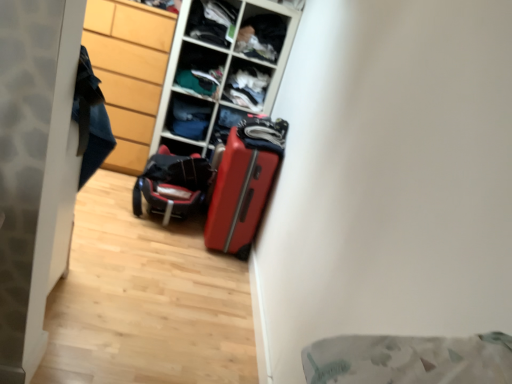
Measure the distance between matte plastic cabinet at center and camera.

The distance of matte plastic cabinet at center from camera is 10.35 feet.

The image size is (512, 384). Find the location of `dark fabric clothes at upper center, which ranks as the second shelf in top-to-bottom order`. dark fabric clothes at upper center, which ranks as the second shelf in top-to-bottom order is located at coordinates (261, 37).

The width and height of the screenshot is (512, 384). What do you see at coordinates (261, 37) in the screenshot? I see `dark fabric clothes at upper center, positioned as the 4th shelf in bottom-to-top order` at bounding box center [261, 37].

Locate an element on the screen. This screenshot has width=512, height=384. shiny red suitcase at center is located at coordinates (243, 183).

What do you see at coordinates (129, 72) in the screenshot? I see `wooden cabinet at left` at bounding box center [129, 72].

What do you see at coordinates (223, 67) in the screenshot?
I see `wooden textured shelf at center, which ranks as the fourth shelf in top-to-bottom order` at bounding box center [223, 67].

You are a GUI agent. You are given a task and a screenshot of the screen. Output one action in this format:
    pyautogui.click(x=<x>, y=<y>)
    Task: Click on the matte plastic cabinet at center
    
    Given the screenshot: What is the action you would take?
    pyautogui.click(x=246, y=86)

In the scene shown: From the image's perspective, is dark fabric clothes at upper center, which ranks as the second shelf in top-to-bottom order, on matte plastic shelf at upper center, which ranks as the third shelf in top-to-bottom order?

Yes.

In the scene shown: Would you say dark fabric clothes at upper center, positioned as the 4th shelf in bottom-to-top order, is outside matte plastic shelf at upper center, which ranks as the third shelf in top-to-bottom order?

Yes, dark fabric clothes at upper center, positioned as the 4th shelf in bottom-to-top order, is located beyond the bounds of matte plastic shelf at upper center, which ranks as the third shelf in top-to-bottom order.

From a real-world perspective, is dark fabric clothes at upper center, which ranks as the second shelf in top-to-bottom order, physically located above or below matte plastic shelf at upper center, which ranks as the third shelf in top-to-bottom order?

From a real-world perspective, dark fabric clothes at upper center, which ranks as the second shelf in top-to-bottom order, is physically above matte plastic shelf at upper center, which ranks as the third shelf in top-to-bottom order.

Consider the image. Between dark fabric clothes at upper center, positioned as the 4th shelf in bottom-to-top order, and matte plastic shelf at upper center, which ranks as the third shelf in bottom-to-top order, which one has larger size?

With larger size is matte plastic shelf at upper center, which ranks as the third shelf in bottom-to-top order.

Can you confirm if dark fabric clothes at upper center, positioned as the 4th shelf in bottom-to-top order, is bigger than denim fabric drawer at center, the 1th shelf in the bottom-to-top sequence?

Yes.

Which is closer, [270,22] or [170,121]?

Point [270,22] is closer to the camera than point [170,121].

From the picture: Is dark fabric clothes at upper center, which ranks as the second shelf in top-to-bottom order, turned away from denim fabric drawer at center, marked as the fifth shelf in a top-to-bottom arrangement?

No, denim fabric drawer at center, marked as the fifth shelf in a top-to-bottom arrangement, is not at the back of dark fabric clothes at upper center, which ranks as the second shelf in top-to-bottom order.

Locate an element on the screen. This screenshot has width=512, height=384. the 2nd shelf behind the dark fabric clothes at upper center, positioned as the 4th shelf in bottom-to-top order is located at coordinates (188, 117).

Considering their positions, is wooden textured shelf at center, arranged as the 2th shelf when ordered from the bottom, located in front of or behind black textured suitcase at center?

Visually, wooden textured shelf at center, arranged as the 2th shelf when ordered from the bottom, is located behind black textured suitcase at center.

This screenshot has height=384, width=512. I want to click on the 1st shelf behind the black textured suitcase at center, starting your count from the anchor, so (x=223, y=67).

Considering the relative sizes of wooden textured shelf at center, which ranks as the fourth shelf in top-to-bottom order, and black textured suitcase at center in the image provided, is wooden textured shelf at center, which ranks as the fourth shelf in top-to-bottom order, shorter than black textured suitcase at center?

In fact, wooden textured shelf at center, which ranks as the fourth shelf in top-to-bottom order, may be taller than black textured suitcase at center.

Considering the sizes of objects black textured suitcase at center and wooden cabinet at left in the image provided, who is bigger, black textured suitcase at center or wooden cabinet at left?

Bigger between the two is wooden cabinet at left.

Choose the correct answer: Is black textured suitcase at center inside wooden cabinet at left or outside it?

black textured suitcase at center is outside wooden cabinet at left.

From the image's perspective, is black textured suitcase at center under wooden cabinet at left?

Yes.

Is shiny red suitcase at center inside denim fabric drawer at center, the 1th shelf in the bottom-to-top sequence?

No, shiny red suitcase at center is not surrounded by denim fabric drawer at center, the 1th shelf in the bottom-to-top sequence.

Is denim fabric drawer at center, the 1th shelf in the bottom-to-top sequence, facing towards shiny red suitcase at center?

No, denim fabric drawer at center, the 1th shelf in the bottom-to-top sequence, is not oriented towards shiny red suitcase at center.

Between point (195, 130) and point (228, 154), which one is positioned behind?

The point (195, 130) is farther.

From a real-world perspective, is wooden cabinet at left beneath matte plastic cabinet at center?

Correct, in the physical world, wooden cabinet at left is lower than matte plastic cabinet at center.

How many degrees apart are the facing directions of wooden cabinet at left and matte plastic cabinet at center?

5.65 degrees separate the facing orientations of wooden cabinet at left and matte plastic cabinet at center.

Is wooden cabinet at left located outside matte plastic cabinet at center?

Indeed, wooden cabinet at left is completely outside matte plastic cabinet at center.

Is wooden cabinet at left in contact with dark fabric clothes at upper center, which ranks as the second shelf in top-to-bottom order?

There is a gap between wooden cabinet at left and dark fabric clothes at upper center, which ranks as the second shelf in top-to-bottom order.

From a real-world perspective, which object stands above the other?

In real-world perspective, dark fabric clothes at upper center, which ranks as the second shelf in top-to-bottom order, is above.

Does point (137, 68) appear closer or farther from the camera than point (274, 55)?

Point (137, 68).

Which of these two, wooden cabinet at left or dark fabric clothes at upper center, which ranks as the second shelf in top-to-bottom order, is smaller?

Smaller between the two is dark fabric clothes at upper center, which ranks as the second shelf in top-to-bottom order.

You are a GUI agent. You are given a task and a screenshot of the screen. Output one action in this format:
    pyautogui.click(x=<x>, y=<y>)
    Task: Click on the 1st shelf positioned above the matte plastic shelf at upper center, which ranks as the third shelf in top-to-bottom order (from the image's perspective)
    Image resolution: width=512 pixels, height=384 pixels.
    Given the screenshot: What is the action you would take?
    pyautogui.click(x=261, y=37)

Find the location of a particular element. shelf that is the 4th one when counting rightward from the denim fabric drawer at center, marked as the fifth shelf in a top-to-bottom arrangement is located at coordinates (261, 37).

Which object lies further to the anchor point shiny red suitcase at center, wooden textured shelf at center, arranged as the 2th shelf when ordered from the bottom, or black textured suitcase at center?

wooden textured shelf at center, arranged as the 2th shelf when ordered from the bottom, lies further to shiny red suitcase at center than the other object.

From the picture: Looking at the image, which one is located closer to dark fabric clothes at upper center, which ranks as the second shelf in top-to-bottom order, matte plastic cabinet at center or wooden cabinet at left?

matte plastic cabinet at center.

When comparing their distances from matte plastic cabinet at center, does wooden cabinet at left or denim fabric drawer at center, marked as the fifth shelf in a top-to-bottom arrangement, seem closer?

The object closer to matte plastic cabinet at center is denim fabric drawer at center, marked as the fifth shelf in a top-to-bottom arrangement.

When comparing their distances from wooden cabinet at left, does dark fabric clothes at upper center, positioned as the 4th shelf in bottom-to-top order, or matte plastic cabinet at center seem further?

Among the two, dark fabric clothes at upper center, positioned as the 4th shelf in bottom-to-top order, is located further to wooden cabinet at left.

Considering their positions, is dark fabric clothes at upper center, which ranks as the second shelf in top-to-bottom order, positioned further to black textured suitcase at center than shiny red suitcase at center?

Based on the image, dark fabric clothes at upper center, which ranks as the second shelf in top-to-bottom order, appears to be further to black textured suitcase at center.

Which object lies further to the anchor point shiny red suitcase at center, wooden cabinet at left or matte plastic shelf at upper center, which ranks as the third shelf in top-to-bottom order?

wooden cabinet at left is further to shiny red suitcase at center.

Estimate the real-world distances between objects in this image. Which object is further from wooden cabinet at left, denim fabric drawer at center, marked as the fifth shelf in a top-to-bottom arrangement, or black textured suitcase at center?

The object further to wooden cabinet at left is black textured suitcase at center.

When comparing their distances from matte plastic cabinet at center, does denim fabric drawer at center, marked as the fifth shelf in a top-to-bottom arrangement, or shiny red suitcase at center seem closer?

denim fabric drawer at center, marked as the fifth shelf in a top-to-bottom arrangement, is closer to matte plastic cabinet at center.

The height and width of the screenshot is (384, 512). Find the location of `luggage between wooden cabinet at left and shiny red suitcase at center in the horizontal direction`. luggage between wooden cabinet at left and shiny red suitcase at center in the horizontal direction is located at coordinates (170, 184).

In order to click on cabinet between matte plastic shelf at upper center, the 1th shelf in the top-to-bottom sequence, and wooden textured shelf at center, which ranks as the fourth shelf in top-to-bottom order, vertically in this screenshot , I will do `click(246, 86)`.

This screenshot has width=512, height=384. Find the location of `cabinet between denim fabric drawer at center, the 1th shelf in the bottom-to-top sequence, and dark fabric clothes at upper center, positioned as the 4th shelf in bottom-to-top order`. cabinet between denim fabric drawer at center, the 1th shelf in the bottom-to-top sequence, and dark fabric clothes at upper center, positioned as the 4th shelf in bottom-to-top order is located at coordinates (246, 86).

The height and width of the screenshot is (384, 512). Identify the location of suitcase between wooden cabinet at left and matte plastic cabinet at center from left to right. (243, 183).